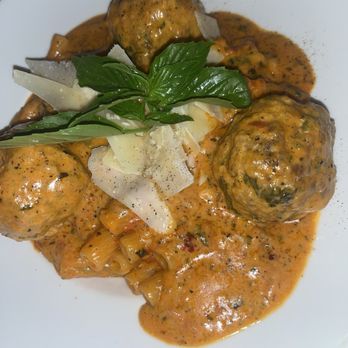
Find the location of a particular element. plate is located at coordinates (294, 335), (63, 330).